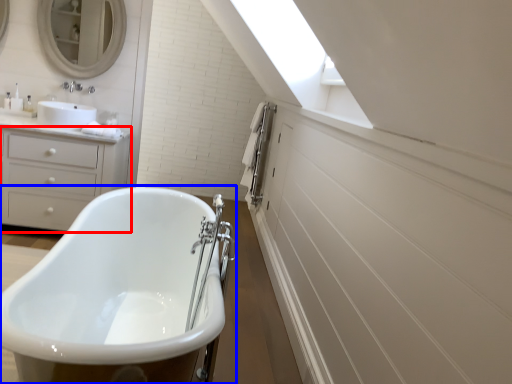
Question: Among these objects, which one is nearest to the camera, chest of drawers (highlighted by a red box) or bathtub (highlighted by a blue box)?

Choices:
 (A) chest of drawers
 (B) bathtub

Answer: (B)